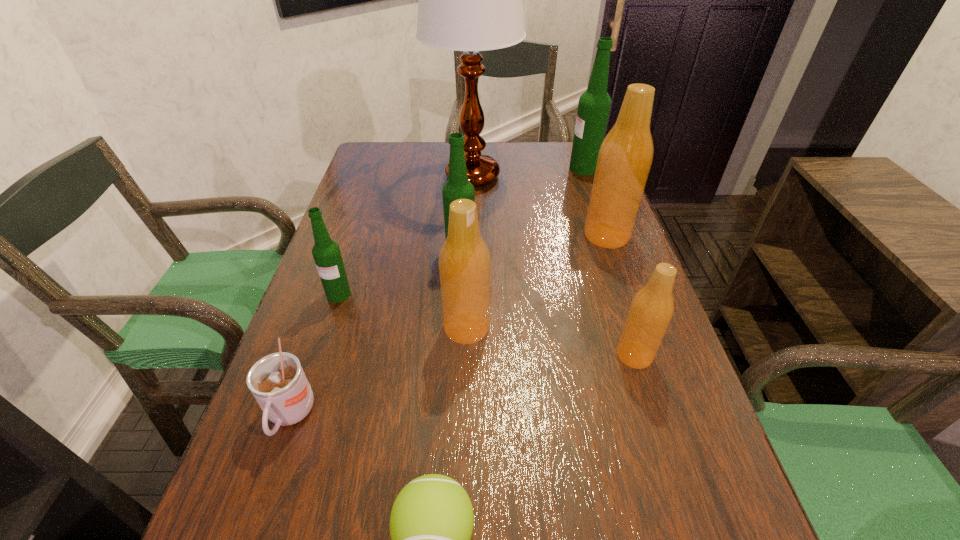
Locate an element on the screen. The image size is (960, 540). vacant area situated on the label of the smallest green beer bottle is located at coordinates (280, 474).

In order to click on free space located on the front of the smallest tan beer bottle in this screenshot , I will do `click(660, 435)`.

Where is `vacant space situated 0.050m on the side with the handle of the cup`? The width and height of the screenshot is (960, 540). vacant space situated 0.050m on the side with the handle of the cup is located at coordinates tap(267, 483).

At what (x,y) coordinates should I click in order to perform the action: click on table lamp situated at the far edge. Please return your answer as a coordinate pair (x, y). Looking at the image, I should click on (470, 0).

Locate an element on the screen. This screenshot has width=960, height=540. beer bottle that is at the far edge is located at coordinates (594, 105).

Identify the location of beer bottle that is at the left edge. This screenshot has width=960, height=540. (326, 253).

The image size is (960, 540). I want to click on cup located at the left edge, so click(277, 381).

You are a GUI agent. You are given a task and a screenshot of the screen. Output one action in this format:
    pyautogui.click(x=<x>, y=<y>)
    Task: Click on the object that is at the far right corner
    The image size is (960, 540).
    Given the screenshot: What is the action you would take?
    pyautogui.click(x=594, y=105)

In the image, there is a desktop. Identify the location of blank space at the far edge. (531, 174).

Image resolution: width=960 pixels, height=540 pixels. I want to click on free region at the left edge, so click(318, 343).